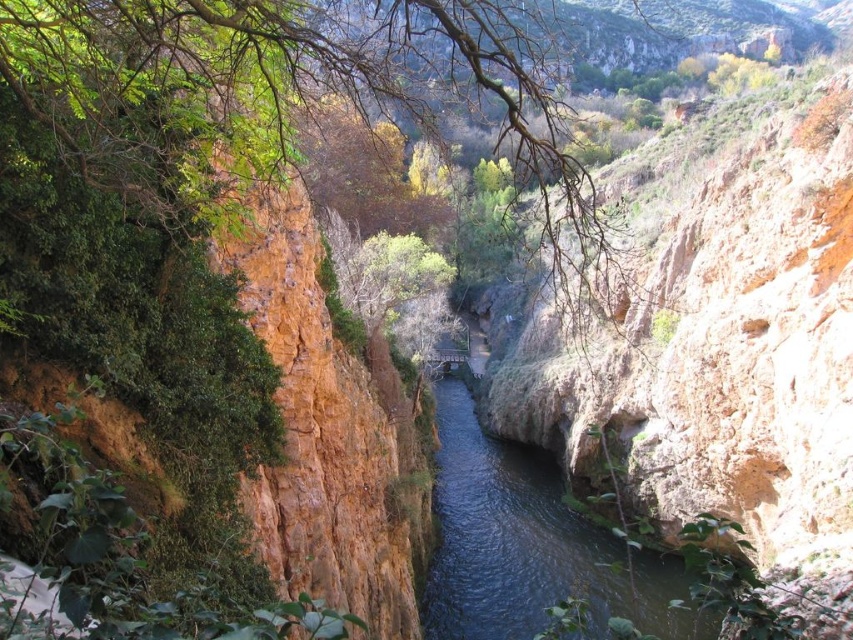
Question: Which of the following is the closest to the observer?

Choices:
 (A) 32,93
 (B) 451,404

Answer: (A)

Question: Considering the relative positions of green leafy tree at center and dark blue water at center in the image provided, where is green leafy tree at center located with respect to dark blue water at center?

Choices:
 (A) left
 (B) right

Answer: (B)

Question: Is the position of green leafy tree at center less distant than that of dark blue water at center?

Choices:
 (A) no
 (B) yes

Answer: (A)

Question: Is green leafy tree at center to the left of dark blue water at center from the viewer's perspective?

Choices:
 (A) no
 (B) yes

Answer: (A)

Question: Among these objects, which one is farthest from the camera?

Choices:
 (A) dark blue water at center
 (B) green leafy tree at center

Answer: (B)

Question: Among these points, which one is nearest to the camera?

Choices:
 (A) (519, 138)
 (B) (463, 544)

Answer: (B)